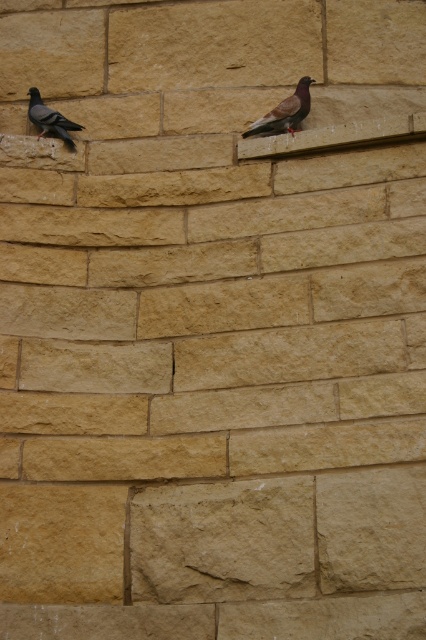
Question: Which object is closer to the camera taking this photo?

Choices:
 (A) matte gray pigeon at upper center
 (B) matte black pigeon at left

Answer: (A)

Question: Observing the image, what is the correct spatial positioning of matte gray pigeon at upper center in reference to matte black pigeon at left?

Choices:
 (A) above
 (B) below

Answer: (A)

Question: Which point appears closest to the camera in this image?

Choices:
 (A) (55, 131)
 (B) (276, 109)

Answer: (B)

Question: Is matte gray pigeon at upper center below matte black pigeon at left?

Choices:
 (A) yes
 (B) no

Answer: (B)

Question: Which point is farther to the camera?

Choices:
 (A) (37, 90)
 (B) (294, 112)

Answer: (A)

Question: Can you confirm if matte gray pigeon at upper center is bigger than matte black pigeon at left?

Choices:
 (A) yes
 (B) no

Answer: (A)